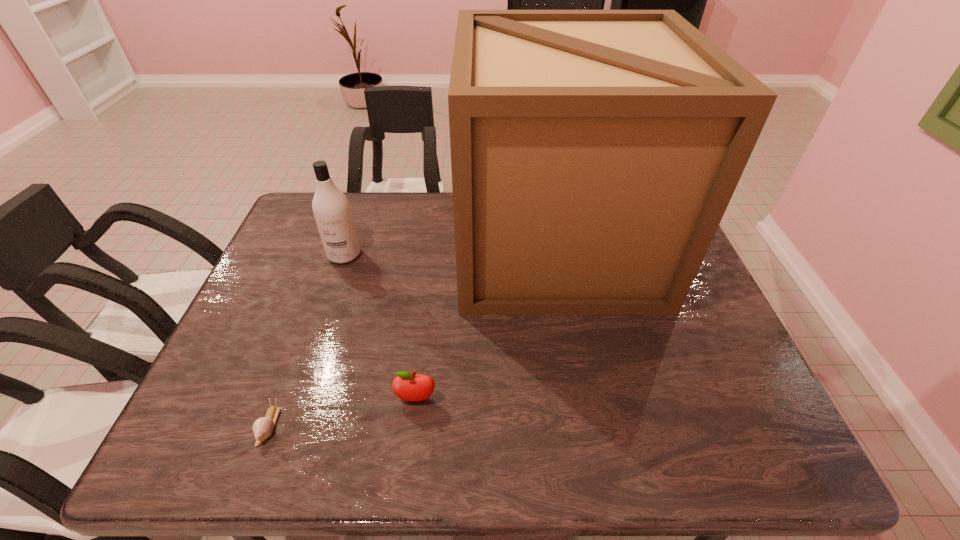
You are a GUI agent. You are given a task and a screenshot of the screen. Output one action in this format:
    pyautogui.click(x=<x>, y=<y>)
    Task: Click on the free location located 0.110m on the front of the second shortest object
    This screenshot has height=540, width=960.
    Given the screenshot: What is the action you would take?
    pyautogui.click(x=409, y=456)

Locate an element on the screen. object located in the far edge section of the desktop is located at coordinates (594, 153).

Where is `object that is at the near edge`? This screenshot has width=960, height=540. object that is at the near edge is located at coordinates (262, 427).

Where is `shampoo that is at the left edge`? shampoo that is at the left edge is located at coordinates (331, 208).

The height and width of the screenshot is (540, 960). I want to click on escargot that is at the left edge, so click(262, 427).

What are the coordinates of `object located in the right edge section of the desktop` in the screenshot? It's located at (594, 153).

The width and height of the screenshot is (960, 540). Find the location of `object that is at the near left corner`. object that is at the near left corner is located at coordinates click(262, 427).

You are a GUI agent. You are given a task and a screenshot of the screen. Output one action in this format:
    pyautogui.click(x=<x>, y=<y>)
    Task: Click on the object that is at the far right corner
    This screenshot has width=960, height=540.
    Given the screenshot: What is the action you would take?
    pyautogui.click(x=594, y=153)

You are a GUI agent. You are given a task and a screenshot of the screen. Output one action in this format:
    pyautogui.click(x=<x>, y=<y>)
    Task: Click on the vacant space at the far edge of the desktop
    
    Given the screenshot: What is the action you would take?
    pyautogui.click(x=360, y=224)

In order to click on free spot at the near edge of the desktop in this screenshot , I will do `click(630, 448)`.